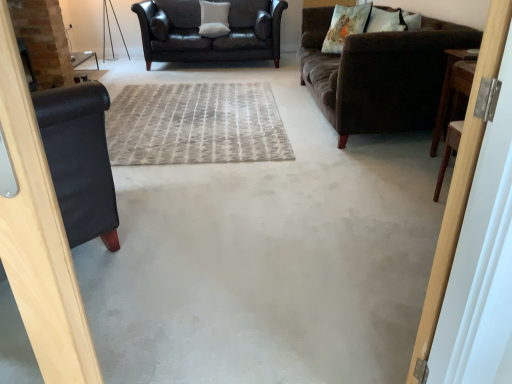
Where is `free space in front of brown velvety couch at upper right, positioned as the 1th studio couch in right-to-left order`? The image size is (512, 384). free space in front of brown velvety couch at upper right, positioned as the 1th studio couch in right-to-left order is located at coordinates (306, 187).